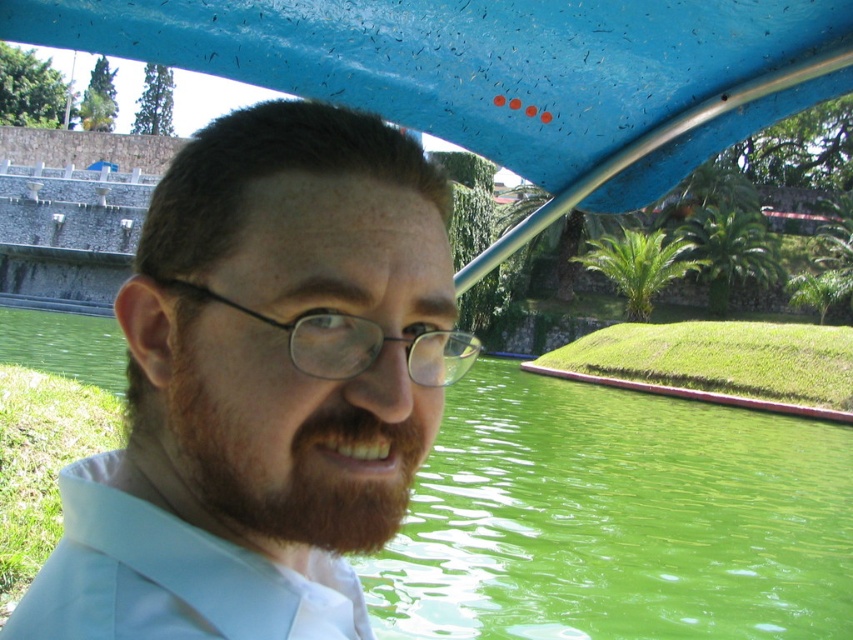
You are a photographer trying to capture the person in the scene. Since the matte blue shirt at center and the green liquid water at center are both at the center, which one should you focus on to ensure the subject is in the foreground?

The matte blue shirt at center should be focused on because it has a lesser height compared to the green liquid water at center, making it closer to the foreground.

You are a bartender preparing a drink for a customer. You have a green liquid water at center and a black plastic glasses at center in front of you. Which one is wider?

The green liquid water at center is wider than the black plastic glasses at center.

Based on the scene description, can you determine if the matte blue shirt at center is above or below the green liquid water at center?

The matte blue shirt at center is positioned over the green liquid water at center, meaning it is above the water.